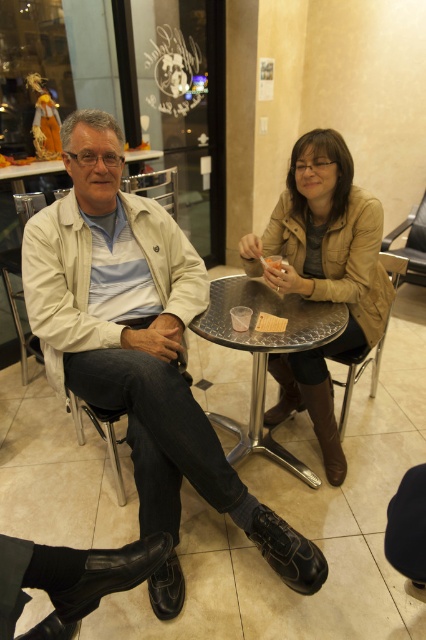
Does matte beige jacket at left have a lesser height compared to light beige fabric chair at left?

No.

Identify the location of matte beige jacket at left. (138, 340).

Does point (356, 195) come farther from viewer compared to point (259, 316)?

Yes, point (356, 195) is farther from viewer.

Does leather jacket at center come behind smooth plastic container at table center?

That is True.

Between point (333, 424) and point (268, 314), which one is positioned in front?

Positioned in front is point (268, 314).

Identify the location of leather jacket at center. (322, 275).

Between matte beige jacket at left and translucent plastic cup at table center, which one has less height?

With less height is translucent plastic cup at table center.

Does matte beige jacket at left have a lesser height compared to translucent plastic cup at table center?

In fact, matte beige jacket at left may be taller than translucent plastic cup at table center.

From the picture: Who is more distant from viewer, (187, 253) or (267, 262)?

Point (187, 253)

Identify the location of matte beige jacket at left. Image resolution: width=426 pixels, height=640 pixels. (138, 340).